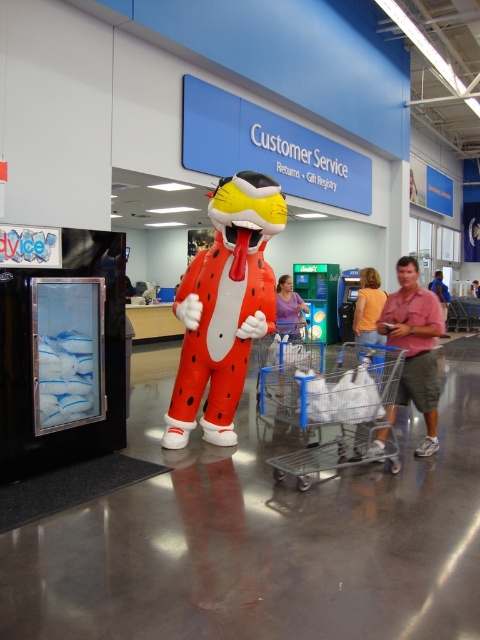
How distant is pink cotton shirt at center from orange cotton shirt at center?

pink cotton shirt at center is 5.54 feet away from orange cotton shirt at center.

Can you confirm if pink cotton shirt at center is positioned to the left of orange cotton shirt at center?

Indeed, pink cotton shirt at center is positioned on the left side of orange cotton shirt at center.

Which is behind, point (403, 342) or point (362, 273)?

The point (362, 273) is behind.

Identify the location of pink cotton shirt at center. Image resolution: width=480 pixels, height=640 pixels. pyautogui.click(x=415, y=346).

Find the location of a particular element. This screenshot has width=480, height=640. inflatable orange at center is located at coordinates (225, 307).

Describe the element at coordinates (225, 307) in the screenshot. I see `inflatable orange at center` at that location.

Between point (242, 200) and point (478, 291), which one is positioned in front?

Point (242, 200) is in front.

I want to click on inflatable orange at center, so click(x=225, y=307).

Is point (272, 387) farther from camera compared to point (280, 388)?

Yes.

Does clear plastic shopping cart at center have a larger size compared to purple cotton shirt at center?

Yes.

Is point (301, 465) in front of point (287, 330)?

That is True.

Image resolution: width=480 pixels, height=640 pixels. Find the location of `clear plastic shopping cart at center`. clear plastic shopping cart at center is located at coordinates (333, 406).